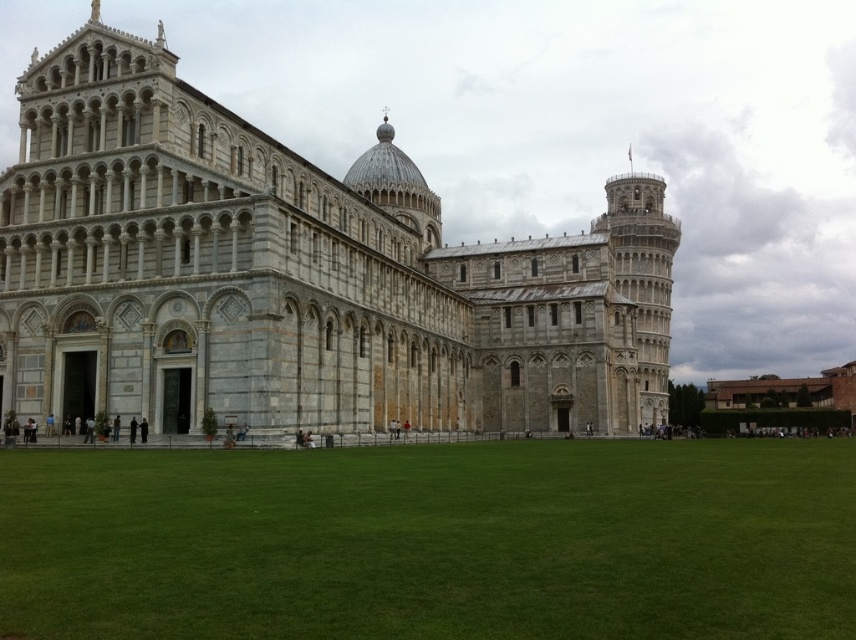
Question: Can you confirm if gray stone cathedral at center is positioned above green grass at center?

Choices:
 (A) yes
 (B) no

Answer: (A)

Question: Which point is farther to the camera?

Choices:
 (A) gray stone cathedral at center
 (B) green grass at center

Answer: (A)

Question: Which point is closer to the camera?

Choices:
 (A) [x=37, y=256]
 (B) [x=276, y=474]

Answer: (B)

Question: Is gray stone cathedral at center below green grass at center?

Choices:
 (A) yes
 (B) no

Answer: (B)

Question: Considering the relative positions of gray stone cathedral at center and green grass at center in the image provided, where is gray stone cathedral at center located with respect to green grass at center?

Choices:
 (A) left
 (B) right

Answer: (B)